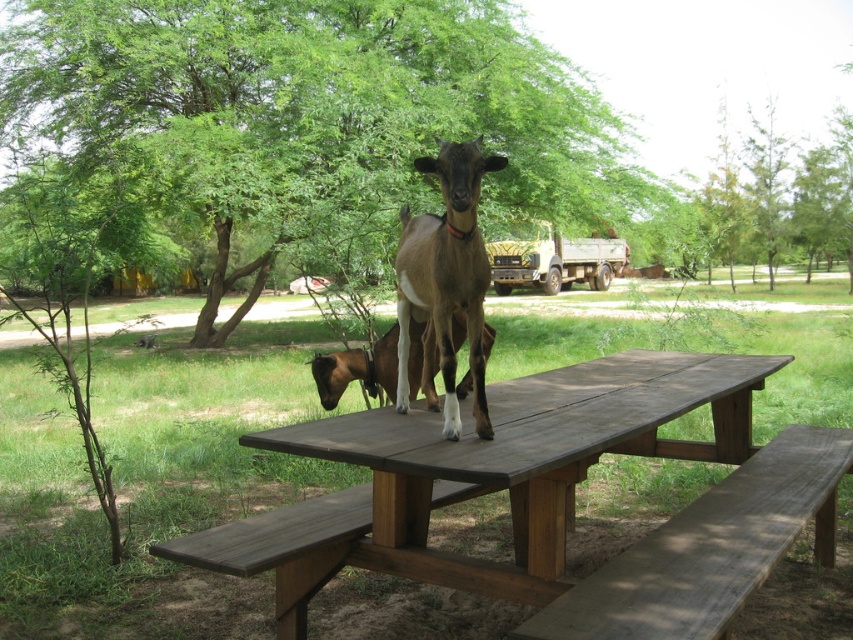
Question: Which object is farther from the camera taking this photo?

Choices:
 (A) green leafy tree at center
 (B) wooden bench at lower right
 (C) brown fur goat at center

Answer: (A)

Question: Does dark brown wood at center appear over brown fur goat at center?

Choices:
 (A) yes
 (B) no

Answer: (B)

Question: Which is farther from the brown matte goat at center?

Choices:
 (A) green leafy tree at center
 (B) brown fur goat at center
 (C) brown wooden picnic table at center

Answer: (A)

Question: Which of these objects is positioned farthest from the dark brown wood at center?

Choices:
 (A) brown fur goat at center
 (B) wooden bench at lower right
 (C) brown wooden picnic table at center

Answer: (B)

Question: Is brown matte goat at center to the left of dark brown wood at center from the viewer's perspective?

Choices:
 (A) no
 (B) yes

Answer: (A)

Question: Does brown wooden picnic table at center have a smaller size compared to brown fur goat at center?

Choices:
 (A) no
 (B) yes

Answer: (A)